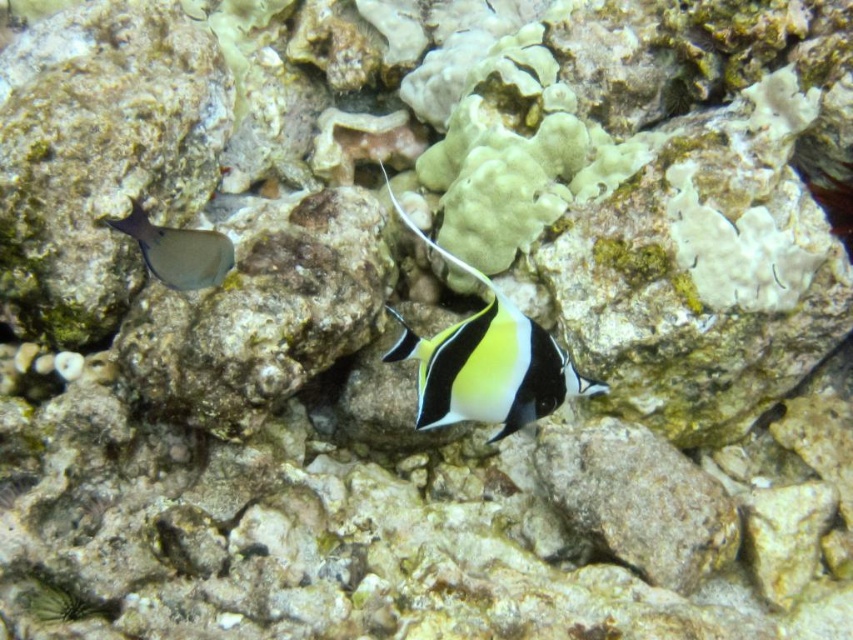
Question: Which of the following is the farthest from the observer?

Choices:
 (A) [x=389, y=362]
 (B) [x=144, y=252]

Answer: (B)

Question: Is black glossy fish at center below smooth gray fish at left?

Choices:
 (A) yes
 (B) no

Answer: (A)

Question: Which of the following is the farthest from the observer?

Choices:
 (A) (178, 241)
 (B) (418, 387)

Answer: (A)

Question: Is black glossy fish at center to the right of smooth gray fish at left from the viewer's perspective?

Choices:
 (A) yes
 (B) no

Answer: (A)

Question: Is black glossy fish at center below smooth gray fish at left?

Choices:
 (A) no
 (B) yes

Answer: (B)